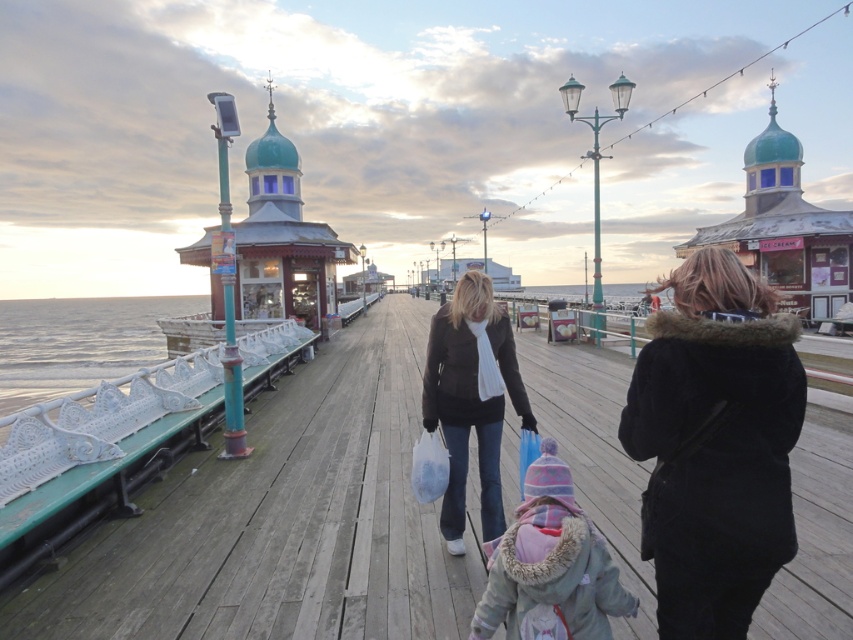
Question: Is wooden dock at center to the right of dark brown leather jacket at center from the viewer's perspective?

Choices:
 (A) yes
 (B) no

Answer: (B)

Question: Can you confirm if black fur-lined coat at center is positioned above dark brown leather jacket at center?

Choices:
 (A) yes
 (B) no

Answer: (A)

Question: Which point is farther to the camera?

Choices:
 (A) dark brown leather jacket at center
 (B) black fur-lined coat at center
 (C) fluffy pink coat at center
 (D) wooden dock at center

Answer: (A)

Question: Which object is closer to the camera taking this photo?

Choices:
 (A) dark brown leather jacket at center
 (B) fluffy pink coat at center
 (C) wooden dock at center
 (D) black fur-lined coat at center

Answer: (D)

Question: Which point is closer to the camera taking this photo?

Choices:
 (A) (466, 337)
 (B) (752, 472)

Answer: (B)

Question: Can you confirm if wooden dock at center is bigger than dark brown leather jacket at center?

Choices:
 (A) yes
 (B) no

Answer: (A)